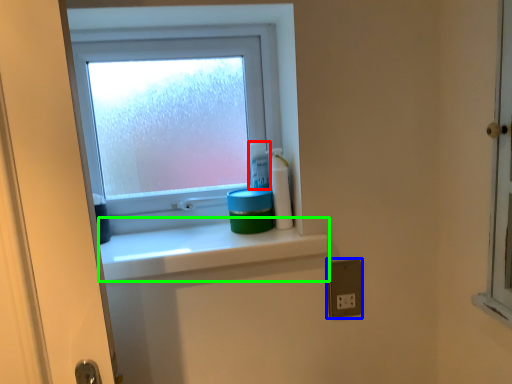
Question: Estimate the real-world distances between objects in this image. Which object is farther from toiletry (highlighted by a red box), electric outlet (highlighted by a blue box) or window sill (highlighted by a green box)?

Choices:
 (A) electric outlet
 (B) window sill

Answer: (A)